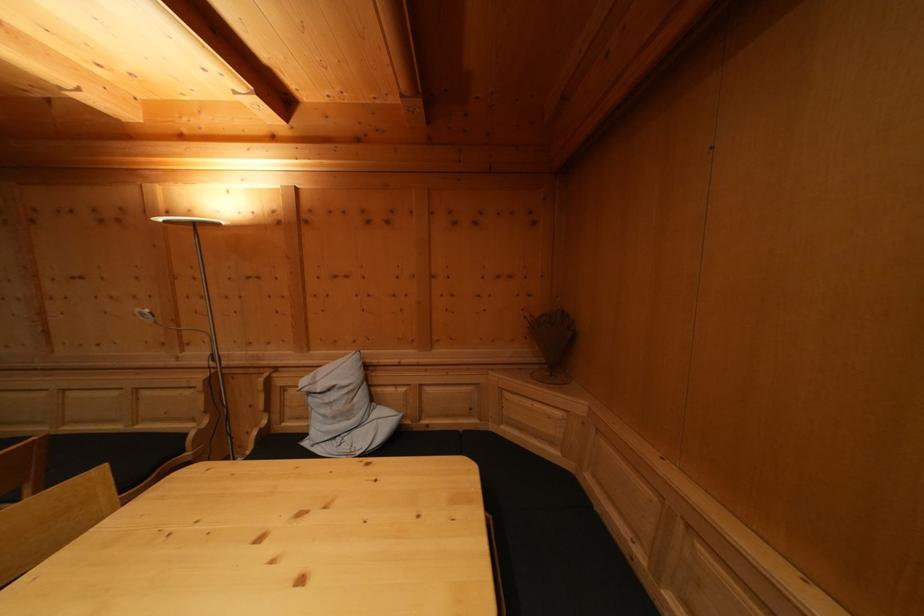
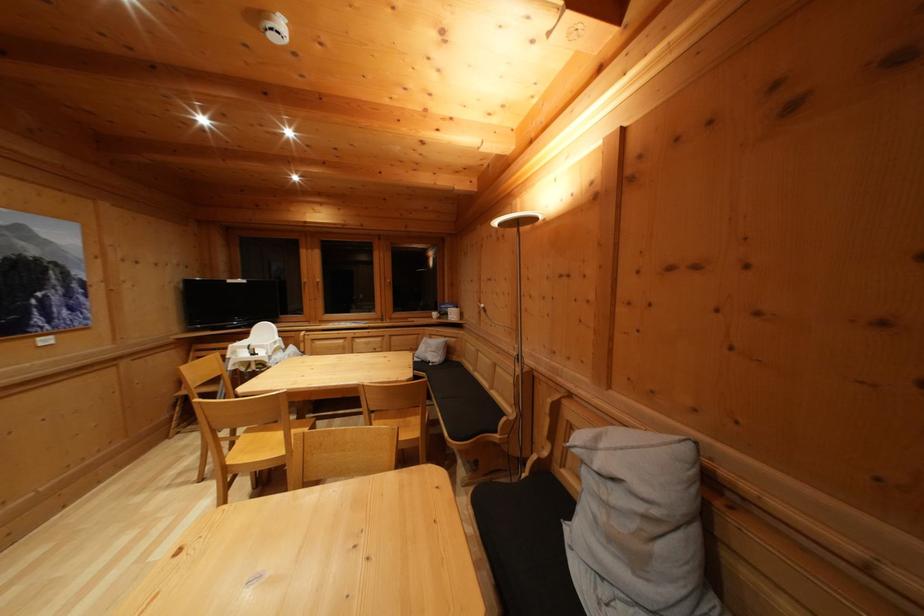
Where in the second image is the point corresponding to (353,421) from the first image?

(640, 565)